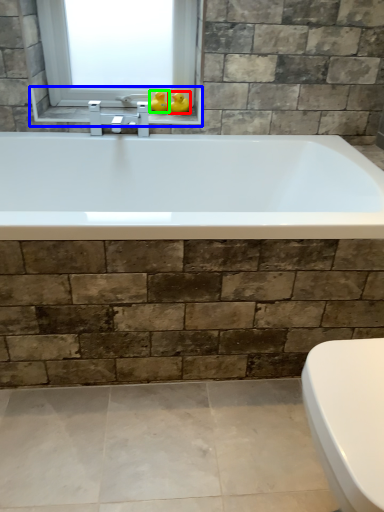
Question: Which object is positioned farthest from duck (highlighted by a red box)? Select from window sill (highlighted by a blue box) and duck (highlighted by a green box).

Choices:
 (A) window sill
 (B) duck

Answer: (A)